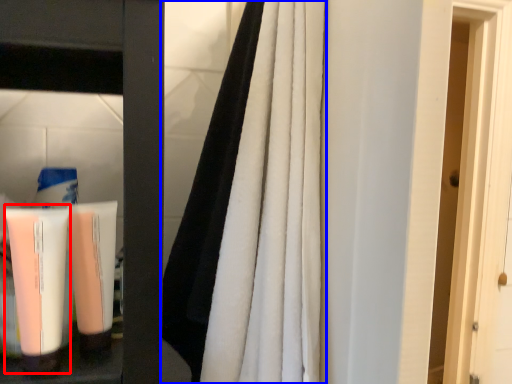
Question: Among these objects, which one is farthest to the camera, cleaning product (highlighted by a red box) or curtain (highlighted by a blue box)?

Choices:
 (A) cleaning product
 (B) curtain

Answer: (A)